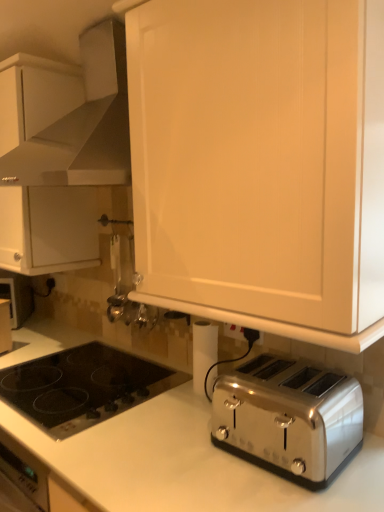
Question: Can black glass cooktop at lower left be found inside white plastic electric outlet at lower center?

Choices:
 (A) yes
 (B) no

Answer: (B)

Question: Is white plastic electric outlet at lower center placed right next to black glass cooktop at lower left?

Choices:
 (A) yes
 (B) no

Answer: (B)

Question: Can you confirm if white plastic electric outlet at lower center is taller than black glass cooktop at lower left?

Choices:
 (A) yes
 (B) no

Answer: (A)

Question: From the image's perspective, is white plastic electric outlet at lower center over black glass cooktop at lower left?

Choices:
 (A) no
 (B) yes

Answer: (B)

Question: Is white plastic electric outlet at lower center shorter than black glass cooktop at lower left?

Choices:
 (A) yes
 (B) no

Answer: (B)

Question: Considering the positions of satin white range hood at upper center and white matte cabinet at upper left, the second cabinetry viewed from the right, in the image, is satin white range hood at upper center wider or thinner than white matte cabinet at upper left, the second cabinetry viewed from the right,?

Choices:
 (A) wide
 (B) thin

Answer: (A)

Question: Visually, is satin white range hood at upper center positioned to the left or to the right of white matte cabinet at upper left, placed as the 1th cabinetry when sorted from left to right?

Choices:
 (A) right
 (B) left

Answer: (A)

Question: From the image's perspective, is satin white range hood at upper center positioned above or below white matte cabinet at upper left, placed as the 2th cabinetry when sorted from front to back?

Choices:
 (A) above
 (B) below

Answer: (A)

Question: Based on their sizes in the image, would you say satin white range hood at upper center is bigger or smaller than white matte cabinet at upper left, placed as the 2th cabinetry when sorted from front to back?

Choices:
 (A) small
 (B) big

Answer: (A)

Question: Visually, is black glass cooktop at lower left positioned to the left or to the right of white plastic electric outlet at lower center?

Choices:
 (A) left
 (B) right

Answer: (A)

Question: From a real-world perspective, is black glass cooktop at lower left above or below white plastic electric outlet at lower center?

Choices:
 (A) above
 (B) below

Answer: (B)

Question: Considering their positions, is black glass cooktop at lower left located in front of or behind white plastic electric outlet at lower center?

Choices:
 (A) front
 (B) behind

Answer: (A)

Question: Does point (162, 366) appear closer or farther from the camera than point (230, 332)?

Choices:
 (A) closer
 (B) farther

Answer: (B)

Question: Is satin chrome toaster at lower right taller or shorter than black glass cooktop at lower left?

Choices:
 (A) short
 (B) tall

Answer: (B)

Question: Considering the positions of point (296, 473) and point (165, 382), is point (296, 473) closer or farther from the camera than point (165, 382)?

Choices:
 (A) closer
 (B) farther

Answer: (A)